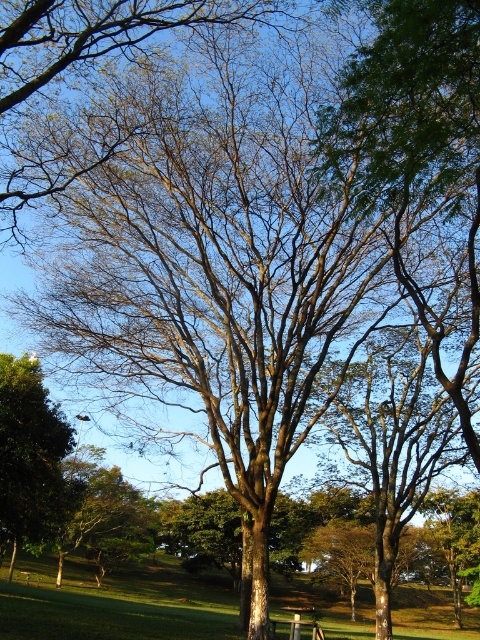
Question: Which point is closer to the camera taking this photo?

Choices:
 (A) (197, 612)
 (B) (48, 506)

Answer: (B)

Question: Does green grass at center have a lesser width compared to green leafy tree at lower left?

Choices:
 (A) no
 (B) yes

Answer: (A)

Question: Is green grass at center bigger than green leafy tree at lower left?

Choices:
 (A) yes
 (B) no

Answer: (A)

Question: Is green grass at center smaller than green leafy tree at lower left?

Choices:
 (A) yes
 (B) no

Answer: (B)

Question: Among these objects, which one is farthest from the camera?

Choices:
 (A) green leafy tree at lower left
 (B) green grass at center

Answer: (A)